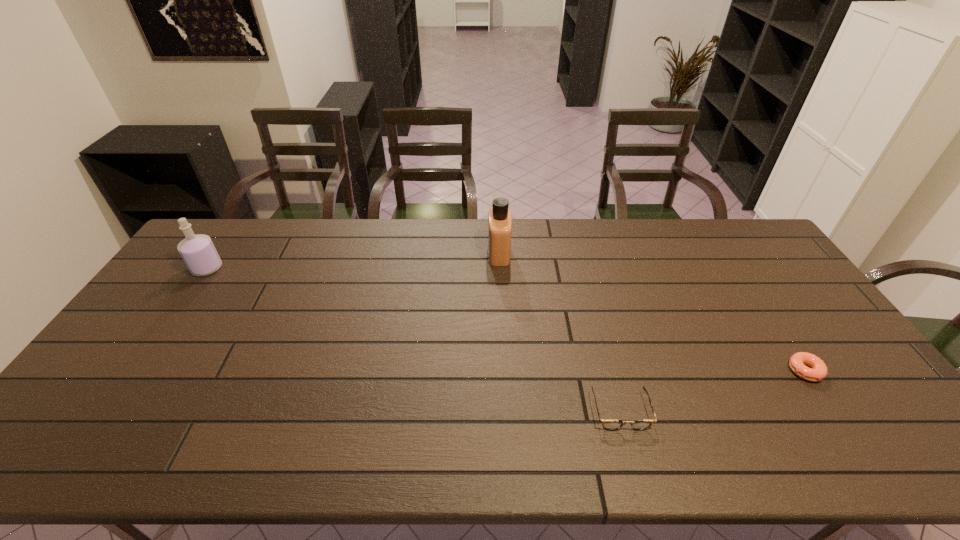
In the image, there is a desktop. Identify the location of free space at the near right corner. (904, 436).

The width and height of the screenshot is (960, 540). I want to click on vacant point located between the third object from right to left and the second nearest object, so click(x=652, y=312).

Where is `free spot between the left perfume and the shortest object`? free spot between the left perfume and the shortest object is located at coordinates (506, 320).

This screenshot has height=540, width=960. Find the location of `empty space between the second object from right to left and the leftmost object`. empty space between the second object from right to left and the leftmost object is located at coordinates (414, 340).

Where is `vacant space in between the third object from left to right and the leftmost object`? The height and width of the screenshot is (540, 960). vacant space in between the third object from left to right and the leftmost object is located at coordinates (414, 340).

Identify the location of free spot between the leftmost object and the right perfume. The height and width of the screenshot is (540, 960). (353, 261).

You are a GUI agent. You are given a task and a screenshot of the screen. Output one action in this format:
    pyautogui.click(x=<x>, y=<y>)
    Task: Click on the vacant space that's between the right perfume and the shortest object
    
    Given the screenshot: What is the action you would take?
    pyautogui.click(x=652, y=312)

You are a GUI agent. You are given a task and a screenshot of the screen. Output one action in this format:
    pyautogui.click(x=<x>, y=<y>)
    Task: Click on the free spot between the spectacles and the left perfume
    The image size is (960, 540).
    Given the screenshot: What is the action you would take?
    pyautogui.click(x=414, y=340)

The image size is (960, 540). In order to click on free spot between the leftmost object and the spectacles in this screenshot , I will do `click(414, 340)`.

This screenshot has height=540, width=960. I want to click on vacant space in between the spectacles and the leftmost object, so click(x=414, y=340).